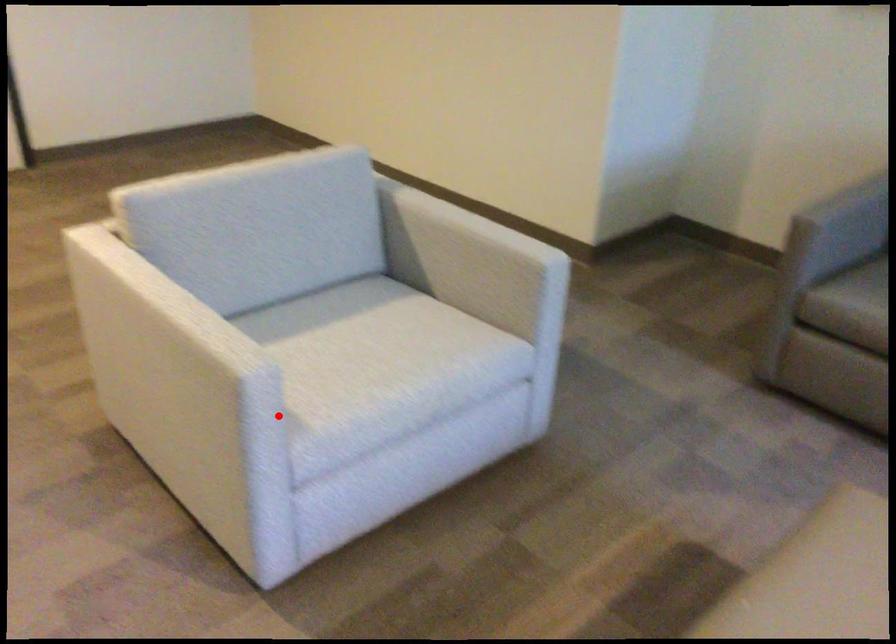
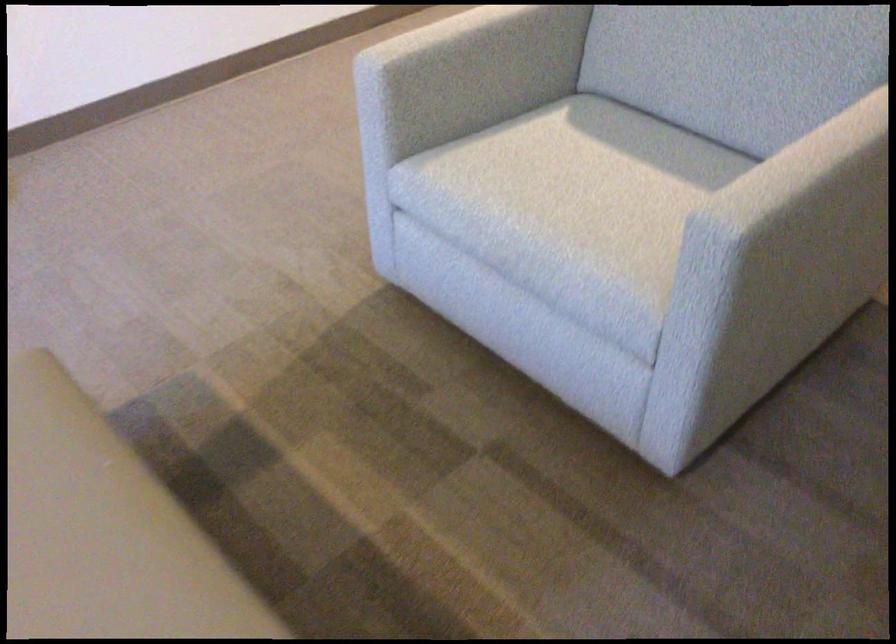
The point at the highlighted location is marked in the first image. Where is the corresponding point in the second image?

(385, 120)